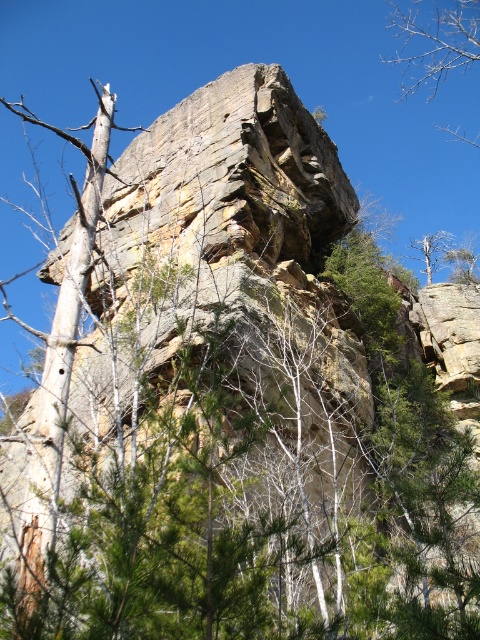
Question: Does bare branches at upper right appear over dead wood tree at upper right?

Choices:
 (A) no
 (B) yes

Answer: (B)

Question: Can you confirm if bare branches at upper right is smaller than dead wood tree at upper right?

Choices:
 (A) no
 (B) yes

Answer: (A)

Question: Does bare branches at upper right lie behind dead wood tree at upper right?

Choices:
 (A) no
 (B) yes

Answer: (B)

Question: Which point appears closest to the camera in this image?

Choices:
 (A) [451, 244]
 (B) [427, 42]

Answer: (A)